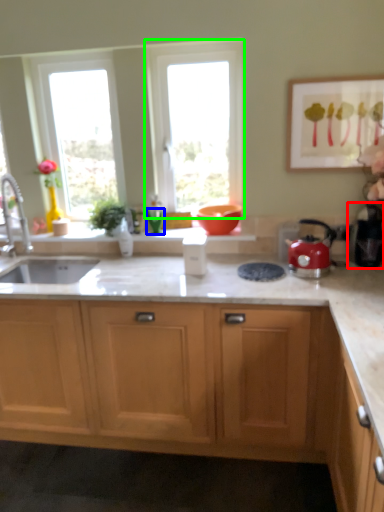
Question: Which is nearer to the coffee machine (highlighted by a red box)? glass vase (highlighted by a blue box) or window (highlighted by a green box).

Choices:
 (A) glass vase
 (B) window

Answer: (B)